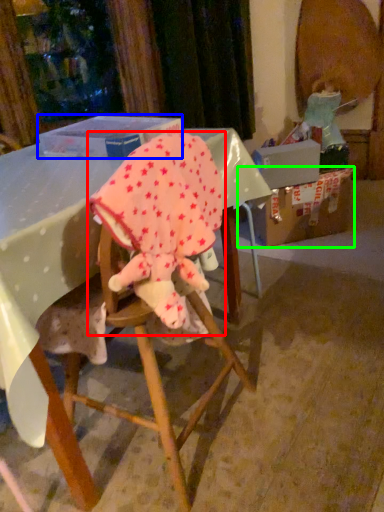
Question: Which object is positioned farthest from baby elephant (highlighted by a red box)? Select from box (highlighted by a blue box) and cardboard box (highlighted by a green box).

Choices:
 (A) box
 (B) cardboard box

Answer: (B)